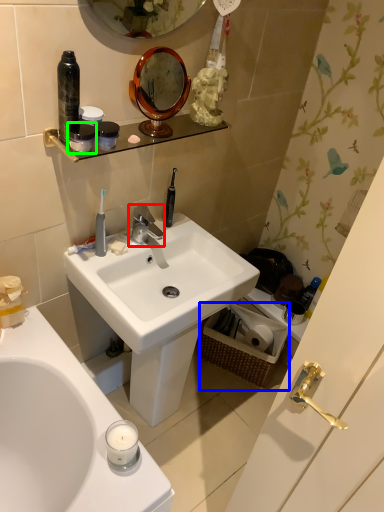
Question: Which object is the farthest from tap (highlighted by a red box)? Choose among these: picnic basket (highlighted by a blue box) or mouthwash (highlighted by a green box).

Choices:
 (A) picnic basket
 (B) mouthwash

Answer: (A)